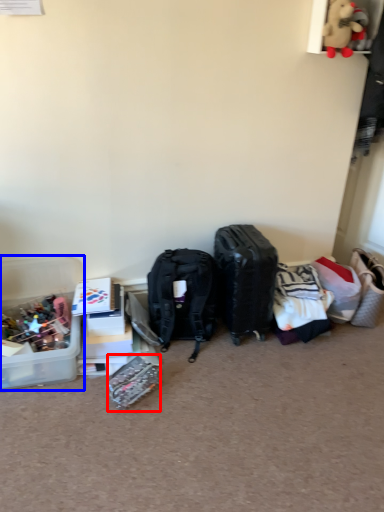
Question: Which point is further to the camera, kit (highlighted by a red box) or box (highlighted by a blue box)?

Choices:
 (A) kit
 (B) box

Answer: (B)